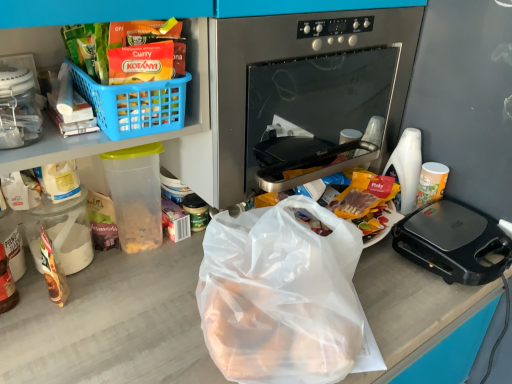
Question: Is black plastic sandwich maker at right taller or shorter than white plastic cup at right, which ranks as the 1th coffee cup in left-to-right order?

Choices:
 (A) short
 (B) tall

Answer: (A)

Question: In terms of size, does black plastic sandwich maker at right appear bigger or smaller than white plastic cup at right, which ranks as the 1th coffee cup in left-to-right order?

Choices:
 (A) small
 (B) big

Answer: (B)

Question: Which of these objects is positioned farthest from the black plastic sandwich maker at right?

Choices:
 (A) white plastic cup at right, which is the second coffee cup from right to left
 (B) white glossy cup at right, marked as the first coffee cup in a right-to-left arrangement
 (C) blue plastic basket at upper left
 (D) stainless steel oven at center

Answer: (C)

Question: Which is farther from the white glossy cup at right, marked as the first coffee cup in a right-to-left arrangement?

Choices:
 (A) white plastic cup at right, which ranks as the 1th coffee cup in left-to-right order
 (B) blue plastic basket at upper left
 (C) stainless steel oven at center
 (D) black plastic sandwich maker at right

Answer: (B)